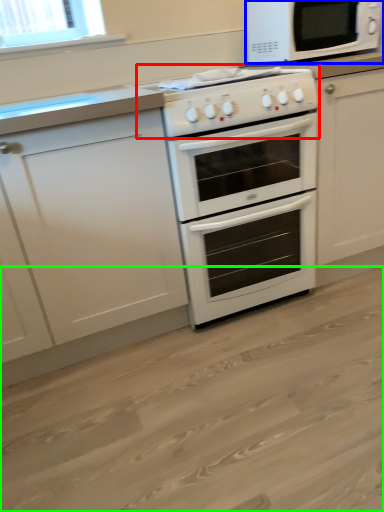
Question: Which object is positioned farthest from gas stove (highlighted by a red box)? Select from microwave oven (highlighted by a blue box) and plain (highlighted by a green box).

Choices:
 (A) microwave oven
 (B) plain

Answer: (B)